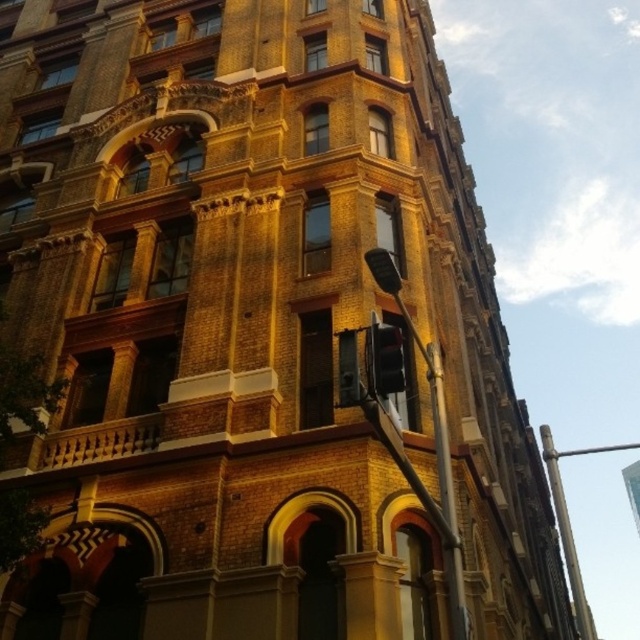
Does metallic pole at center appear on the left side of black glass traffic light at center?

No, metallic pole at center is not to the left of black glass traffic light at center.

Between metallic pole at center and black glass traffic light at center, which one appears on the left side from the viewer's perspective?

Positioned to the left is black glass traffic light at center.

Where is `metallic pole at center`? metallic pole at center is located at coordinates (435, 440).